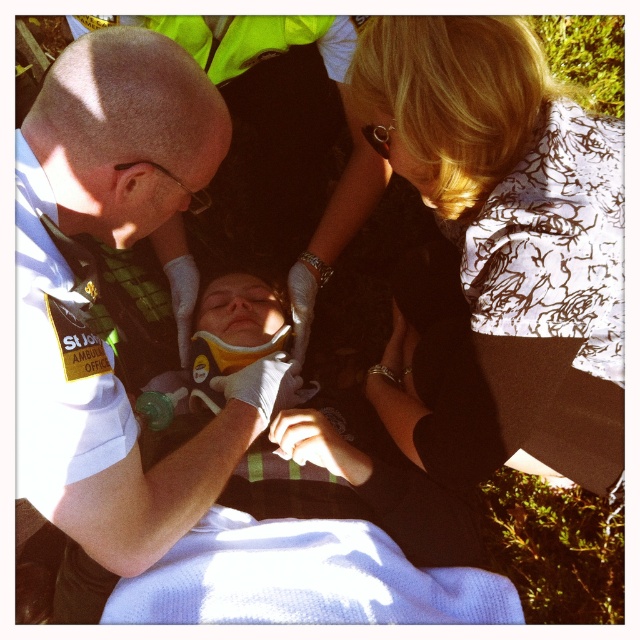
You are a photographer trying to capture a clear shot of the blonde hair at upper right and the white matte uniform at center. Which object is closer to the camera?

The blonde hair at upper right is closer to the camera than the white matte uniform at center because it is shorter in the image.

You are a photographer capturing this scene. You need to ensure both the blonde hair at upper right and the yellow soft plastic at center are visible in your photo. Given their height difference, which object might require you to adjust your camera angle to include it in the frame?

The blonde hair at upper right is much taller than the yellow soft plastic at center, so you might need to angle your camera downward to include the taller blonde hair at upper right in the frame.

Based on the photo, you are a first responder arriving at the scene and need to quickly identify the medical equipment. Which object is smaller in size between the white matte uniform at center and the yellow soft plastic at center?

The white matte uniform at center is smaller in size compared to the yellow soft plastic at center according to the description.